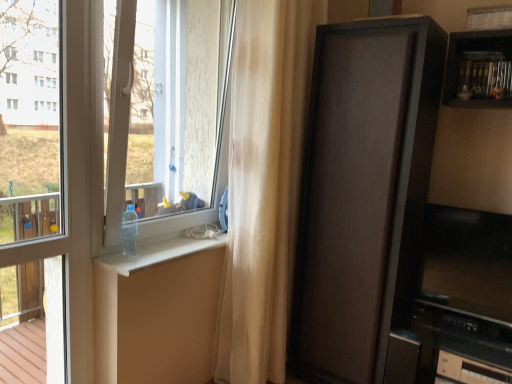
Question: Considering their positions, is clear glass window at left located in front of or behind clear plastic bottle at lower center?

Choices:
 (A) behind
 (B) front

Answer: (B)

Question: Based on their sizes in the image, would you say clear glass window at left is bigger or smaller than clear plastic bottle at lower center?

Choices:
 (A) small
 (B) big

Answer: (B)

Question: Considering the real-world distances, which object is farthest from the sheer beige curtain at center?

Choices:
 (A) black plastic drawer at lower right
 (B) clear glass window at left
 (C) matte brown cabinet at right
 (D) clear plastic bottle at lower center
 (E) transparent plastic window screen at left

Answer: (A)

Question: Estimate the real-world distances between objects in this image. Which object is farther from the clear plastic bottle at lower center?

Choices:
 (A) matte brown cabinet at right
 (B) clear glass window at left
 (C) black plastic drawer at lower right
 (D) sheer beige curtain at center
 (E) transparent plastic window screen at left

Answer: (C)